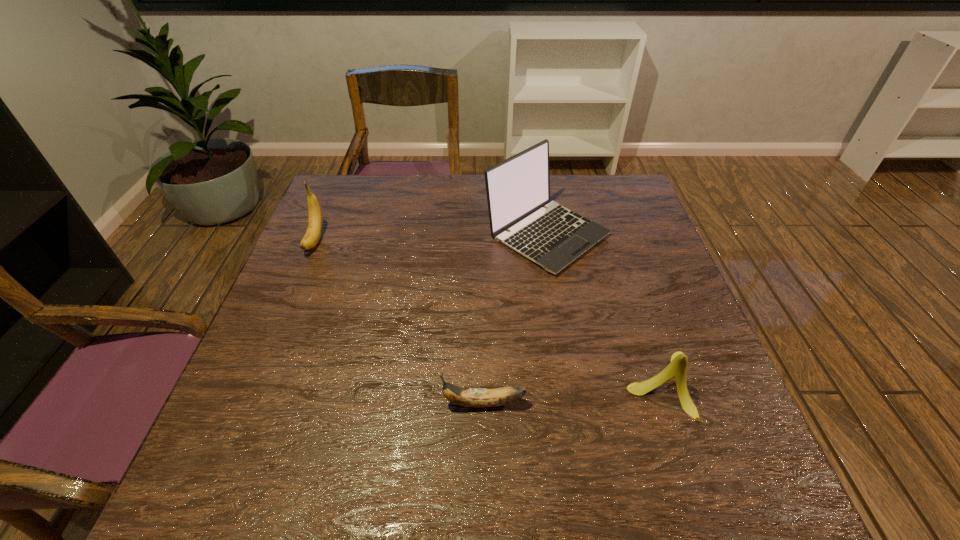
The image size is (960, 540). In the image, there is a desktop. What are the coordinates of `free space at the left edge` in the screenshot? It's located at (312, 326).

At what (x,y) coordinates should I click in order to perform the action: click on free spot at the right edge of the desktop. Please return your answer as a coordinate pair (x, y). This screenshot has height=540, width=960. Looking at the image, I should click on (630, 298).

The width and height of the screenshot is (960, 540). Identify the location of free space at the far left corner of the desktop. pyautogui.click(x=342, y=195).

I want to click on free space at the far right corner of the desktop, so click(x=587, y=193).

Locate an element on the screen. unoccupied area between the tallest object and the second banana from left to right is located at coordinates (515, 318).

This screenshot has height=540, width=960. I want to click on free point between the laptop_computer and the shortest object, so [515, 318].

Locate an element on the screen. The image size is (960, 540). vacant area between the tallest banana and the tallest object is located at coordinates (431, 237).

The width and height of the screenshot is (960, 540). I want to click on unoccupied area between the farthest banana and the second shortest object, so click(x=488, y=312).

Identify the location of empty location between the leftmost object and the laptop_computer. This screenshot has width=960, height=540. (431, 237).

The image size is (960, 540). In order to click on free spot between the shortest object and the third shortest object in this screenshot , I will do `click(399, 321)`.